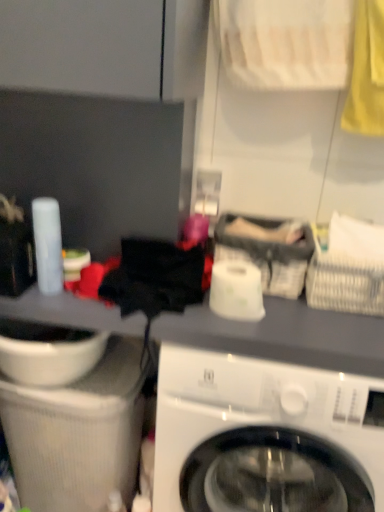
I want to click on vacant area that is situated to the right of white glossy toilet paper at center, so click(306, 317).